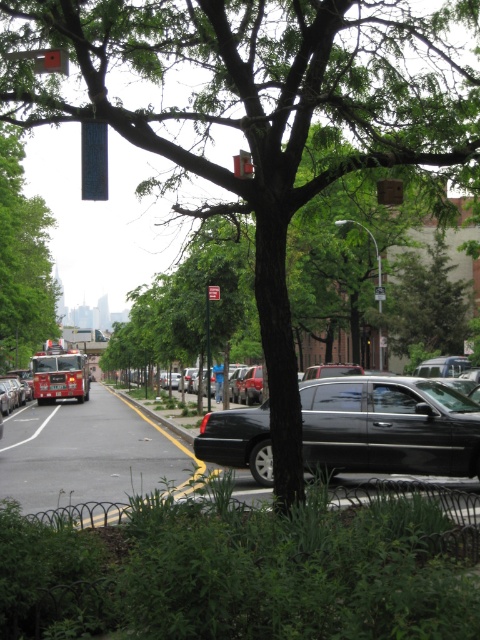
You are a delivery person trying to park your van in the street. You see the green leafy tree at center and the metallic rectangular at upper center. Which object is closer to the street level?

The metallic rectangular at upper center is closer to the street level because the green leafy tree at center is positioned over it, meaning the tree is above the metallic rectangular at upper center.

You are standing at the point with coordinates point (247,168) and want to walk towards the point with coordinates point (55,320). Since you can only move forward, will you get closer to the camera as you walk towards your destination?

Yes, because point (55,320) is further to the camera than point (247,168). When you walk towards point (55,320), you are moving in the direction that is closer to the camera.

You are standing at the point marked by the coordinates point (3, 144) in the image. A friend is approaching you from the direction of the red fire truck. How far will your friend have to walk to reach you?

Your friend will have to walk 33.53 meters to reach you from the direction of the red fire truck because the distance of point (3, 144) from the viewer is 33.53 meters.